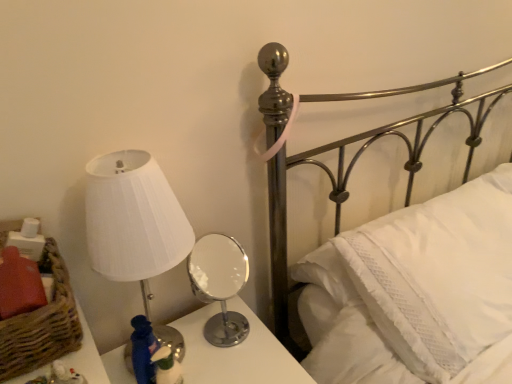
Describe the element at coordinates (439, 275) in the screenshot. I see `white textured pillow at upper right` at that location.

Identify the location of brown woven basket at lower left. (42, 324).

What are the coordinates of `polished chrome mirror at center` in the screenshot? It's located at (236, 353).

Are white pleated fabric lampshade at left and metallic silver bed at upper right located far from each other?

No, white pleated fabric lampshade at left is not far from metallic silver bed at upper right.

Is white pleated fabric lampshade at left wider than metallic silver bed at upper right?

In fact, white pleated fabric lampshade at left might be narrower than metallic silver bed at upper right.

How different are the orientations of white pleated fabric lampshade at left and metallic silver bed at upper right in degrees?

The facing directions of white pleated fabric lampshade at left and metallic silver bed at upper right are 2.41 degrees apart.

From a real-world perspective, does white pleated fabric lampshade at left sit lower than metallic silver bed at upper right?

No.

What are the coordinates of `lamp located on the left of polished chrome mirror at center` in the screenshot? It's located at 133,220.

Which is more to the left, white pleated fabric lampshade at left or polished chrome mirror at center?

white pleated fabric lampshade at left.

From a real-world perspective, is white pleated fabric lampshade at left on top of polished chrome mirror at center?

Yes, from a real-world perspective, white pleated fabric lampshade at left is above polished chrome mirror at center.

Which object is closer to the camera, white pleated fabric lampshade at left or polished chrome mirror at center?

Positioned in front is white pleated fabric lampshade at left.

Is white textured pillow at upper right positioned in front of brown woven basket at lower left?

No, it is behind brown woven basket at lower left.

Can you confirm if white textured pillow at upper right is positioned to the right of brown woven basket at lower left?

Indeed, white textured pillow at upper right is positioned on the right side of brown woven basket at lower left.

How different are the orientations of white textured pillow at upper right and brown woven basket at lower left in degrees?

0.919 degrees.

In the image, there is a brown woven basket at lower left. Where is `pillow above it (from the image's perspective)`? This screenshot has height=384, width=512. pillow above it (from the image's perspective) is located at coordinates (439, 275).

Could you tell me if metallic silver bed at upper right is facing brown woven basket at lower left?

No, metallic silver bed at upper right does not turn towards brown woven basket at lower left.

Which of these two, metallic silver bed at upper right or brown woven basket at lower left, stands shorter?

brown woven basket at lower left.

Which object is positioned more to the left, metallic silver bed at upper right or brown woven basket at lower left?

brown woven basket at lower left is more to the left.

From a real-world perspective, is white pleated fabric lampshade at left physically above white textured pillow at upper right?

Yes.

Considering the sizes of white pleated fabric lampshade at left and white textured pillow at upper right in the image, is white pleated fabric lampshade at left bigger or smaller than white textured pillow at upper right?

Considering their sizes, white pleated fabric lampshade at left takes up less space than white textured pillow at upper right.

Between white pleated fabric lampshade at left and white textured pillow at upper right, which one is positioned behind?

white textured pillow at upper right is further from the camera.

How different are the orientations of white pleated fabric lampshade at left and white textured pillow at upper right in degrees?

3.68 degrees.

From the picture: From the image's perspective, is metallic silver table lamp at center beneath white pleated fabric lampshade at left?

Yes.

From a real-world perspective, which is physically below, metallic silver table lamp at center or white pleated fabric lampshade at left?

metallic silver table lamp at center is physically lower.

Is metallic silver table lamp at center situated inside white pleated fabric lampshade at left or outside?

metallic silver table lamp at center is not inside white pleated fabric lampshade at left, it's outside.

Which object is wider, metallic silver table lamp at center or white pleated fabric lampshade at left?

Wider between the two is white pleated fabric lampshade at left.

Locate an element on the screen. The height and width of the screenshot is (384, 512). pillow in front of the metallic silver table lamp at center is located at coordinates (439, 275).

Does white textured pillow at upper right have a greater width compared to metallic silver table lamp at center?

Yes, white textured pillow at upper right is wider than metallic silver table lamp at center.

Is white textured pillow at upper right oriented away from metallic silver table lamp at center?

No, metallic silver table lamp at center is not at the back of white textured pillow at upper right.

Is white textured pillow at upper right placed right next to metallic silver table lamp at center?

No, white textured pillow at upper right is not in contact with metallic silver table lamp at center.

Image resolution: width=512 pixels, height=384 pixels. In the image, there is a white pleated fabric lampshade at left. In order to click on bed below it (from a real-world perspective) in this screenshot , I will do `click(340, 156)`.

Locate an element on the screen. The image size is (512, 384). lamp in front of the polished chrome mirror at center is located at coordinates (133, 220).

Looking at the image, which one is located closer to white textured pillow at upper right, metallic silver table lamp at center or white pleated fabric lampshade at left?

Among the two, white pleated fabric lampshade at left is located nearer to white textured pillow at upper right.

Which object lies further to the anchor point white pleated fabric lampshade at left, brown woven basket at lower left or metallic silver table lamp at center?

The object further to white pleated fabric lampshade at left is metallic silver table lamp at center.

Looking at the image, which one is located further to metallic silver table lamp at center, brown woven basket at lower left or white textured pillow at upper right?

brown woven basket at lower left is further to metallic silver table lamp at center.

Considering their positions, is polished chrome mirror at center positioned further to metallic silver bed at upper right than white textured pillow at upper right?

polished chrome mirror at center is positioned further to the anchor metallic silver bed at upper right.

From the image, which object appears to be nearer to white pleated fabric lampshade at left, polished chrome mirror at center or white textured pillow at upper right?

Among the two, polished chrome mirror at center is located nearer to white pleated fabric lampshade at left.

When comparing their distances from white pleated fabric lampshade at left, does polished chrome mirror at center or brown woven basket at lower left seem further?

Based on the image, polished chrome mirror at center appears to be further to white pleated fabric lampshade at left.

Considering their positions, is metallic silver table lamp at center positioned further to polished chrome mirror at center than white textured pillow at upper right?

Among the two, metallic silver table lamp at center is located further to polished chrome mirror at center.

When comparing their distances from brown woven basket at lower left, does white textured pillow at upper right or white pleated fabric lampshade at left seem closer?

white pleated fabric lampshade at left is positioned closer to the anchor brown woven basket at lower left.

You are a GUI agent. You are given a task and a screenshot of the screen. Output one action in this format:
    pyautogui.click(x=<x>, y=<y>)
    Task: Click on the pillow between polished chrome mirror at center and metallic silver bed at upper right in the horizontal direction
    
    Given the screenshot: What is the action you would take?
    pyautogui.click(x=439, y=275)

Where is `table lamp between polished chrome mirror at center and white textured pillow at upper right`? Image resolution: width=512 pixels, height=384 pixels. table lamp between polished chrome mirror at center and white textured pillow at upper right is located at coordinates (220, 285).

This screenshot has width=512, height=384. Identify the location of pillow between brown woven basket at lower left and metallic silver bed at upper right. (439, 275).

You are a GUI agent. You are given a task and a screenshot of the screen. Output one action in this format:
    pyautogui.click(x=<x>, y=<y>)
    Task: Click on the lamp situated between brown woven basket at lower left and metallic silver table lamp at center from left to right
    This screenshot has width=512, height=384.
    Given the screenshot: What is the action you would take?
    tap(133, 220)